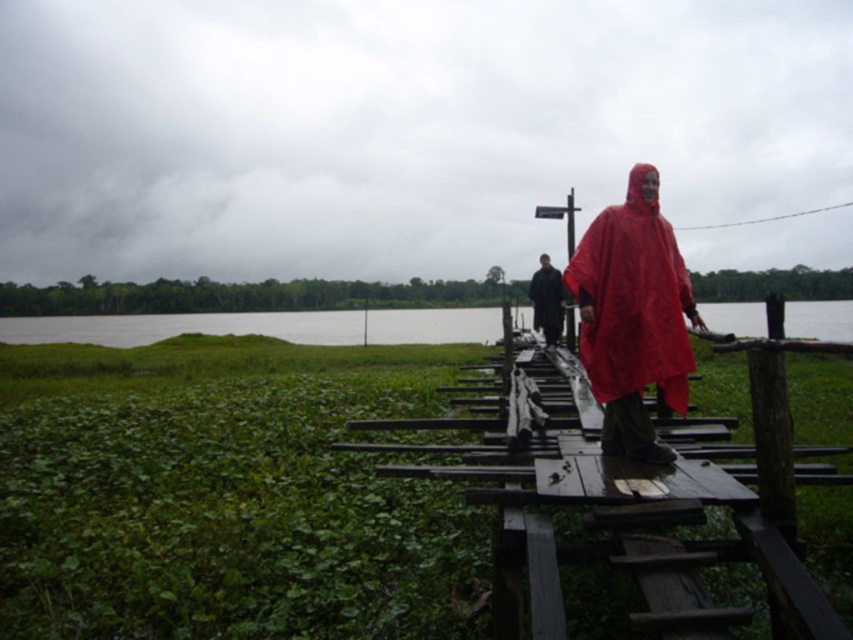
Is matte red poncho at center positioned at the back of matte black raincoat at center?

No, it is in front of matte black raincoat at center.

Describe the element at coordinates (633, 316) in the screenshot. This screenshot has width=853, height=640. I see `matte red poncho at center` at that location.

This screenshot has width=853, height=640. I want to click on matte red poncho at center, so click(x=633, y=316).

Who is higher up, green grass at lower left or matte black raincoat at center?

matte black raincoat at center

Between green grass at lower left and matte black raincoat at center, which one is positioned lower?

green grass at lower left is lower down.

Between point (50, 340) and point (556, 321), which one is positioned behind?

Positioned behind is point (50, 340).

This screenshot has height=640, width=853. I want to click on green grass at lower left, so click(184, 326).

Does wooden dock at center have a lesser width compared to matte red poncho at center?

Correct, wooden dock at center's width is less than matte red poncho at center's.

Identify the location of wooden dock at center. (630, 506).